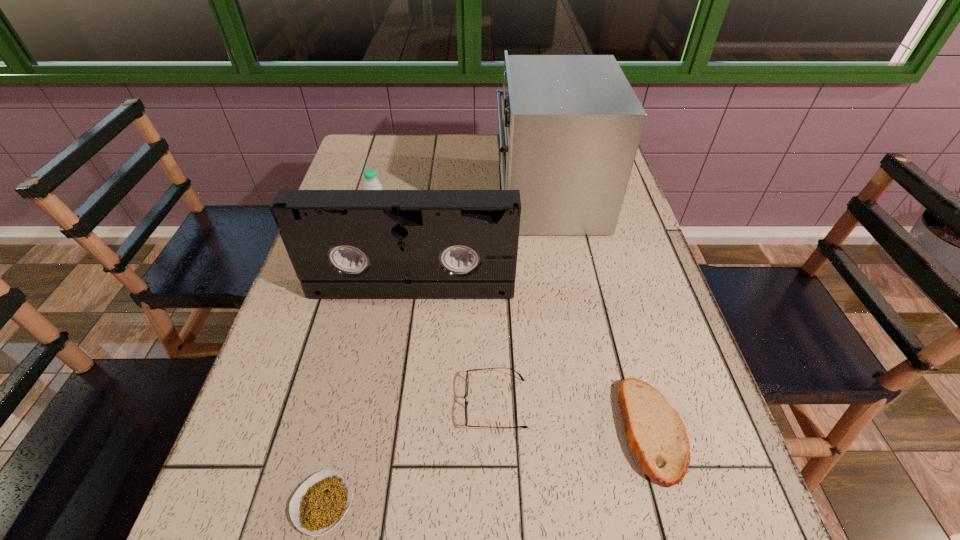
Image resolution: width=960 pixels, height=540 pixels. What are the coordinates of `toaster oven` in the screenshot? It's located at (570, 125).

You are a GUI agent. You are given a task and a screenshot of the screen. Output one action in this format:
    pyautogui.click(x=<x>, y=<y>)
    Task: Click on the videotape
    Image resolution: width=960 pixels, height=540 pixels.
    Given the screenshot: What is the action you would take?
    pyautogui.click(x=343, y=244)

The image size is (960, 540). In order to click on the fourth nearest object in this screenshot , I will do `click(343, 244)`.

Find the location of a particular element. The image size is (960, 540). the fourth shortest object is located at coordinates (372, 183).

Locate an element on the screen. The height and width of the screenshot is (540, 960). pita bread is located at coordinates (657, 436).

Locate an element on the screen. The width and height of the screenshot is (960, 540). the fifth tallest object is located at coordinates (467, 376).

Image resolution: width=960 pixels, height=540 pixels. Find the location of `the shortest object`. the shortest object is located at coordinates (321, 502).

You are a GUI agent. You are given a task and a screenshot of the screen. Output one action in this format:
    pyautogui.click(x=<x>, y=<y>)
    Task: Click on the vacant space located 0.200m on the front panel of the toaster oven
    The image size is (960, 540).
    Given the screenshot: What is the action you would take?
    pyautogui.click(x=427, y=199)

I want to click on free space located on the front panel of the toaster oven, so coord(406,199).

Locate an element on the screen. Image resolution: width=960 pixels, height=540 pixels. vacant space positioned on the front panel of the toaster oven is located at coordinates (444, 199).